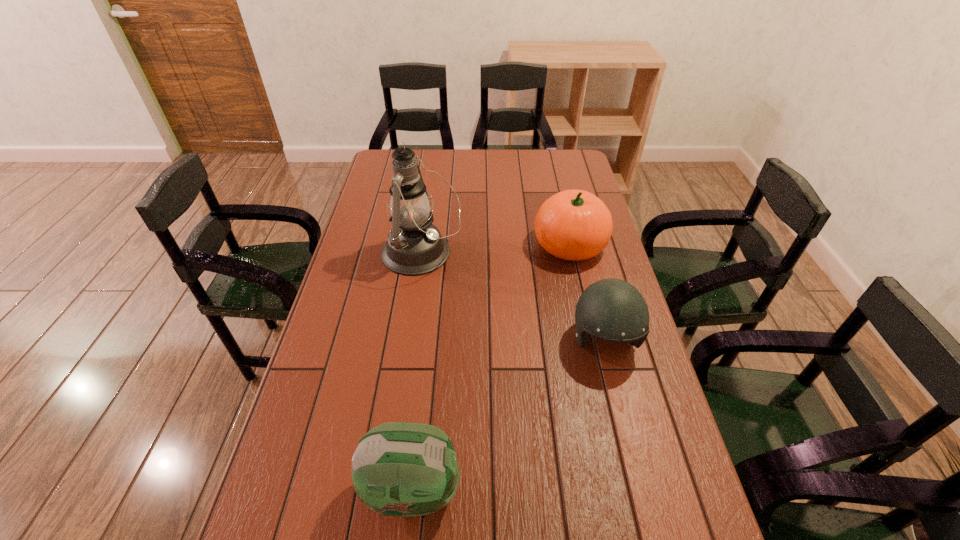
In order to click on the tallest object in this screenshot , I will do coord(414,246).

The width and height of the screenshot is (960, 540). I want to click on pumpkin, so click(x=573, y=224).

In order to click on the left football helmet in this screenshot , I will do [402, 469].

The image size is (960, 540). In order to click on the nearer football helmet in this screenshot , I will do `click(402, 469)`.

The height and width of the screenshot is (540, 960). Find the location of `the farther football helmet`. the farther football helmet is located at coordinates (613, 310).

What are the coordinates of `the right football helmet` in the screenshot? It's located at (613, 310).

You are a GUI agent. You are given a task and a screenshot of the screen. Output one action in this format:
    pyautogui.click(x=<x>, y=<y>)
    Task: Click on the blank space located on the back of the oil lamp
    This screenshot has width=960, height=540.
    Given the screenshot: What is the action you would take?
    pyautogui.click(x=427, y=212)

Locate an element on the screen. vacant area situated on the left of the pumpkin is located at coordinates (422, 245).

Find the location of `free space located on the visor of the left football helmet`. free space located on the visor of the left football helmet is located at coordinates (630, 489).

Where is `vacant space located 0.360m at the face opening of the right football helmet`? vacant space located 0.360m at the face opening of the right football helmet is located at coordinates (649, 518).